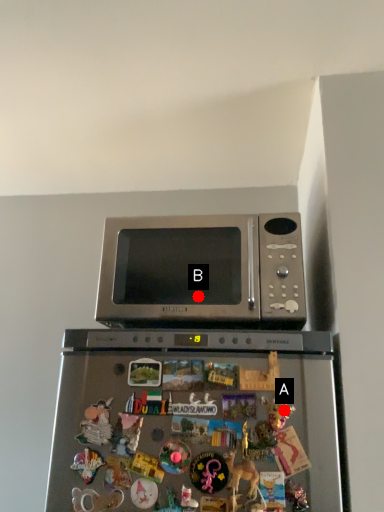
Question: Two points are circled on the image, labeled by A and B beside each circle. Which point is farther from the camera taking this photo?

Choices:
 (A) A is further
 (B) B is further

Answer: (B)